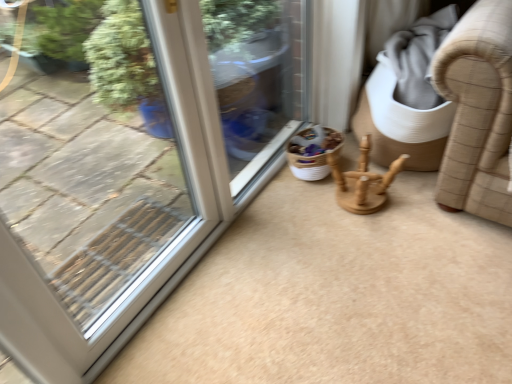
This screenshot has height=384, width=512. What do you see at coordinates (408, 97) in the screenshot?
I see `beige woven armchair at right` at bounding box center [408, 97].

Find the location of a particular element. beige woven armchair at right is located at coordinates (408, 97).

This screenshot has width=512, height=384. I want to click on beige woven armchair at right, so click(x=408, y=97).